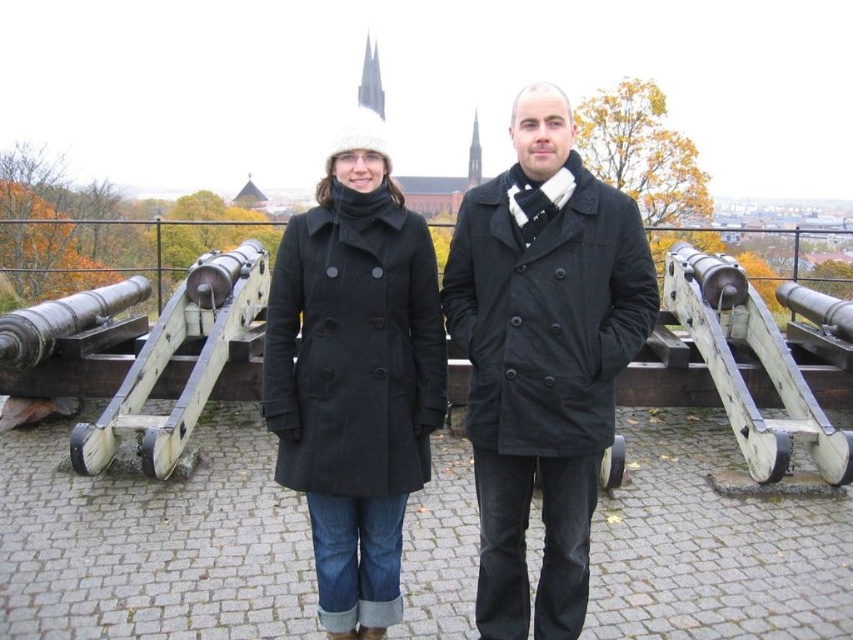
Between point (363, 349) and point (259, 298), which one is positioned in front?

Point (363, 349) is more forward.

Which of these two, black woolen coat at center or wooden cannon at center, stands taller?

black woolen coat at center is taller.

Identify the location of black woolen coat at center. The width and height of the screenshot is (853, 640). (354, 348).

Can you confirm if wooden cannon at right is positioned to the left of wooden cannon at center?

In fact, wooden cannon at right is to the right of wooden cannon at center.

Is point (694, 336) closer to camera compared to point (207, 268)?

No, it is behind (207, 268).

This screenshot has height=640, width=853. What are the coordinates of `wooden cannon at right` in the screenshot? It's located at (757, 358).

Who is lower down, black woolen coat at center or wooden cannon at right?

Positioned lower is black woolen coat at center.

The image size is (853, 640). I want to click on black woolen coat at center, so click(354, 348).